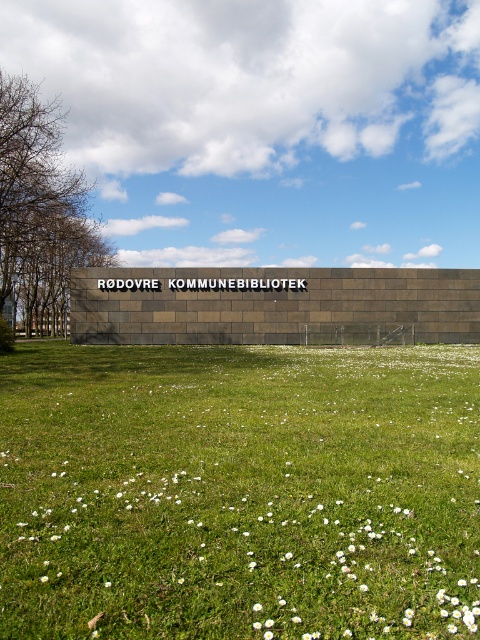
Question: Is green grass at center closer to camera compared to white fluffy flower at center?

Choices:
 (A) no
 (B) yes

Answer: (B)

Question: Is white fluffy flower at center below white matte flower at center?

Choices:
 (A) yes
 (B) no

Answer: (A)

Question: Does green grass at center have a lesser width compared to white matte flower at center?

Choices:
 (A) no
 (B) yes

Answer: (A)

Question: Which object appears closest to the camera in this image?

Choices:
 (A) green grass at center
 (B) white fluffy flower at center

Answer: (A)

Question: Which of the following is the farthest from the observer?

Choices:
 (A) (108, 586)
 (B) (256, 605)

Answer: (A)

Question: Which point is farther from the camera taking this photo?

Choices:
 (A) tap(107, 582)
 (B) tap(257, 605)

Answer: (A)